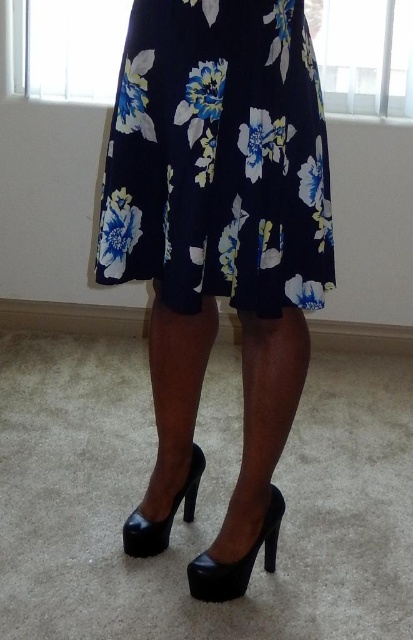
Is floral print skirt at center smaller than black leather high-heeled shoe at center?

No.

Does point (109, 266) come closer to viewer compared to point (137, 529)?

Yes, point (109, 266) is in front of point (137, 529).

Does point (146, 122) come farther from viewer compared to point (125, 540)?

No.

You are a GUI agent. You are given a task and a screenshot of the screen. Output one action in this format:
    pyautogui.click(x=<x>, y=<y>)
    Task: Click on the floral print skirt at center
    
    Given the screenshot: What is the action you would take?
    pyautogui.click(x=218, y=157)

Find the location of a particular element. black patent leather high-heeled shoe at lower center is located at coordinates [x=237, y=561].

Can you confirm if black patent leather high-heeled shoe at lower center is positioned to the left of black leather high-heeled shoe at center?

Incorrect, black patent leather high-heeled shoe at lower center is not on the left side of black leather high-heeled shoe at center.

This screenshot has height=640, width=413. What do you see at coordinates (237, 561) in the screenshot? I see `black patent leather high-heeled shoe at lower center` at bounding box center [237, 561].

Locate an element on the screen. Image resolution: width=413 pixels, height=640 pixels. black patent leather high-heeled shoe at lower center is located at coordinates (237, 561).

Does floral print skirt at center appear on the left side of black patent leather high-heeled shoe at lower center?

Yes, floral print skirt at center is to the left of black patent leather high-heeled shoe at lower center.

Looking at this image, is the position of floral print skirt at center more distant than that of black patent leather high-heeled shoe at lower center?

No, floral print skirt at center is closer to the viewer.

Who is more distant from viewer, (123, 198) or (213, 564)?

The point (213, 564) is behind.

At what (x,y) coordinates should I click in order to perform the action: click on floral print skirt at center. Please return your answer as a coordinate pair (x, y). Looking at the image, I should click on (218, 157).